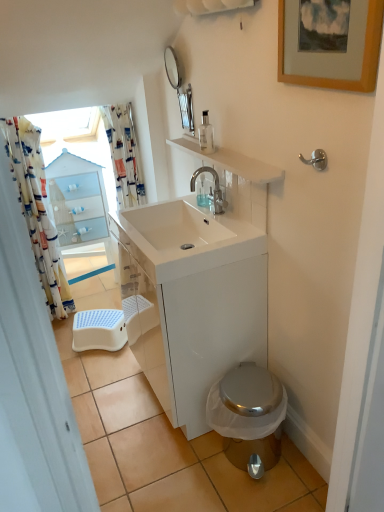
Find the location of `free space in front of white glossy cabinet at center`. free space in front of white glossy cabinet at center is located at coordinates (200, 475).